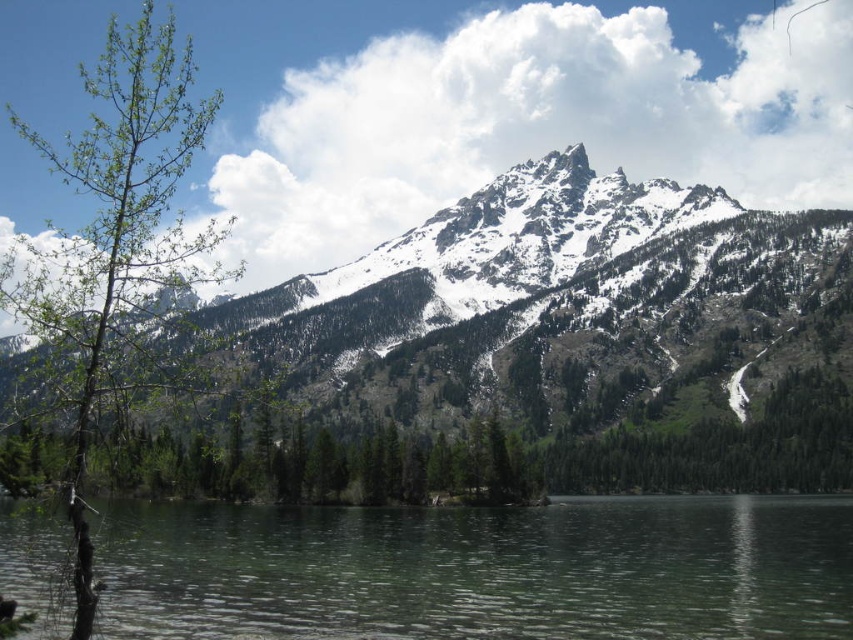
Question: Does snowy rocky mountain at center lie in front of green leafy tree at left?

Choices:
 (A) yes
 (B) no

Answer: (B)

Question: Considering the real-world distances, which object is farthest from the clear water at center?

Choices:
 (A) snowy rocky mountain at center
 (B) green leafy tree at left

Answer: (B)

Question: Does clear water at center appear over snowy rocky mountain at center?

Choices:
 (A) yes
 (B) no

Answer: (B)

Question: Can you confirm if snowy rocky mountain at center is bigger than green leafy tree at left?

Choices:
 (A) yes
 (B) no

Answer: (A)

Question: Which point is farther from the camera taking this photo?

Choices:
 (A) (193, 630)
 (B) (430, 248)
 (C) (105, 308)

Answer: (B)

Question: Which object is the closest to the green leafy tree at left?

Choices:
 (A) snowy rocky mountain at center
 (B) clear water at center

Answer: (A)